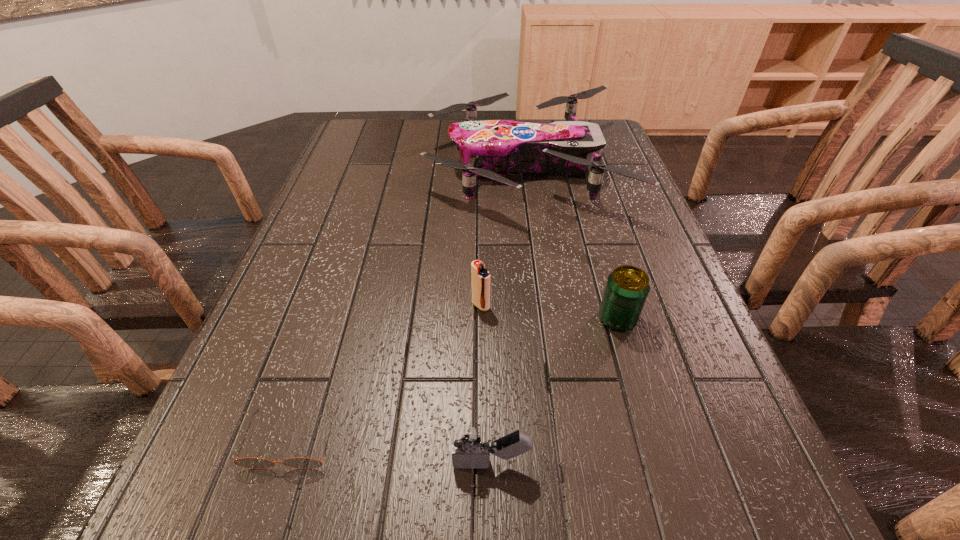
The width and height of the screenshot is (960, 540). I want to click on free space located 0.080m on the back of the beer can, so click(606, 278).

Identify the location of vacant space located on the back of the farther igniter. The height and width of the screenshot is (540, 960). (481, 220).

You are a GUI agent. You are given a task and a screenshot of the screen. Output one action in this format:
    pyautogui.click(x=<x>, y=<y>)
    Task: Click on the free space located 0.080m on the face of the sunglasses
    
    Given the screenshot: What is the action you would take?
    pyautogui.click(x=263, y=528)

Where is `object that is positioned at the far edge`? Image resolution: width=960 pixels, height=540 pixels. object that is positioned at the far edge is located at coordinates (491, 148).

Where is `object located at the left edge`? object located at the left edge is located at coordinates (253, 463).

What are the coordinates of `drone that is at the right edge` in the screenshot? It's located at (491, 148).

I want to click on beer can that is positioned at the right edge, so click(627, 288).

Find the location of a particular element. object present at the far right corner is located at coordinates (491, 148).

Locate an element on the screen. Image resolution: width=960 pixels, height=540 pixels. blank space at the far edge of the desktop is located at coordinates (520, 120).

In the image, there is a desktop. At what (x,y) coordinates should I click in order to perform the action: click on vacant region at the left edge. Please return your answer as a coordinate pair (x, y). The width and height of the screenshot is (960, 540). Looking at the image, I should click on (344, 274).